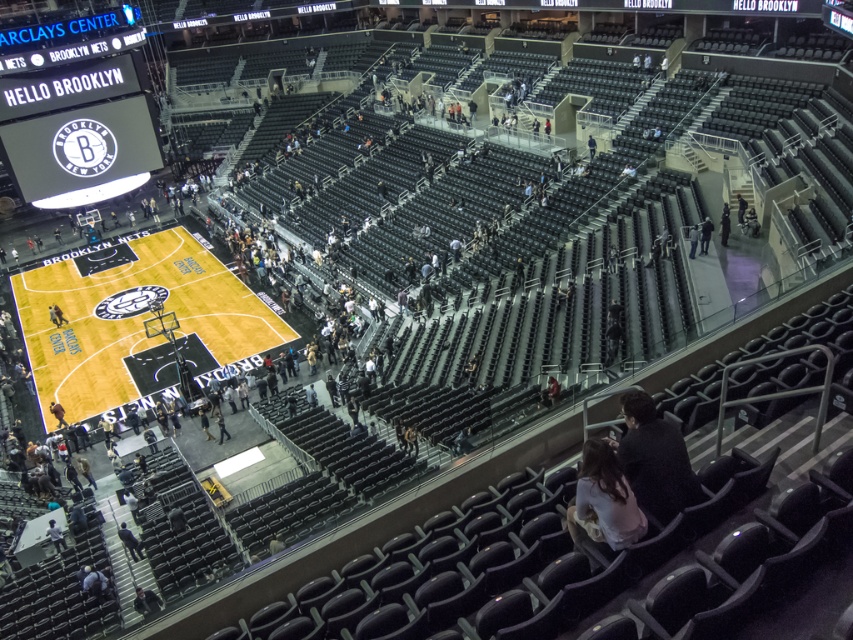
Does yellow polished wood basketball court at center appear under white fabric at lower right?

No.

Is point (56, 273) in front of point (599, 547)?

No.

Which is behind, point (88, 385) or point (607, 518)?

Positioned behind is point (88, 385).

Find the location of a particular element. yellow polished wood basketball court at center is located at coordinates (132, 320).

Is yellow polished wood basketball court at center to the right of dark gray jacket at center from the viewer's perspective?

No, yellow polished wood basketball court at center is not to the right of dark gray jacket at center.

From the picture: Is the position of yellow polished wood basketball court at center less distant than that of dark gray jacket at center?

That is False.

Does point (241, 291) come behind point (706, 225)?

Yes, point (241, 291) is farther from viewer.

You are a GUI agent. You are given a task and a screenshot of the screen. Output one action in this format:
    pyautogui.click(x=<x>, y=<y>)
    Task: Click on the yellow polished wood basketball court at center
    This screenshot has height=640, width=853.
    Given the screenshot: What is the action you would take?
    pyautogui.click(x=132, y=320)

Can you confirm if white fabric at lower right is positioned above dark gray jacket at center?

Incorrect, white fabric at lower right is not positioned above dark gray jacket at center.

Between white fabric at lower right and dark gray jacket at center, which one is positioned lower?

white fabric at lower right

Is point (570, 509) closer to viewer compared to point (711, 232)?

Yes, it is.

At what (x,y) coordinates should I click in order to perform the action: click on white fabric at lower right. Please return your answer as a coordinate pair (x, y). Looking at the image, I should click on (602, 502).